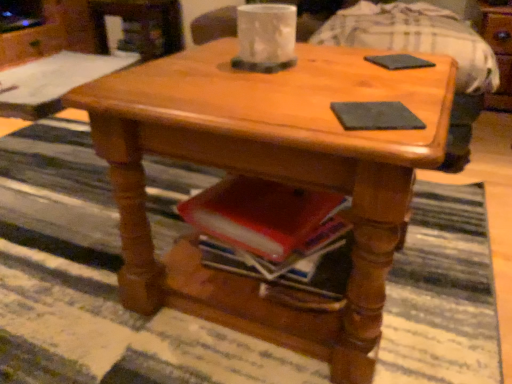
Where is `vacant space to the left of black matte pad at upper right, which appears as the 1th pad when viewed from the right`? vacant space to the left of black matte pad at upper right, which appears as the 1th pad when viewed from the right is located at coordinates (328, 64).